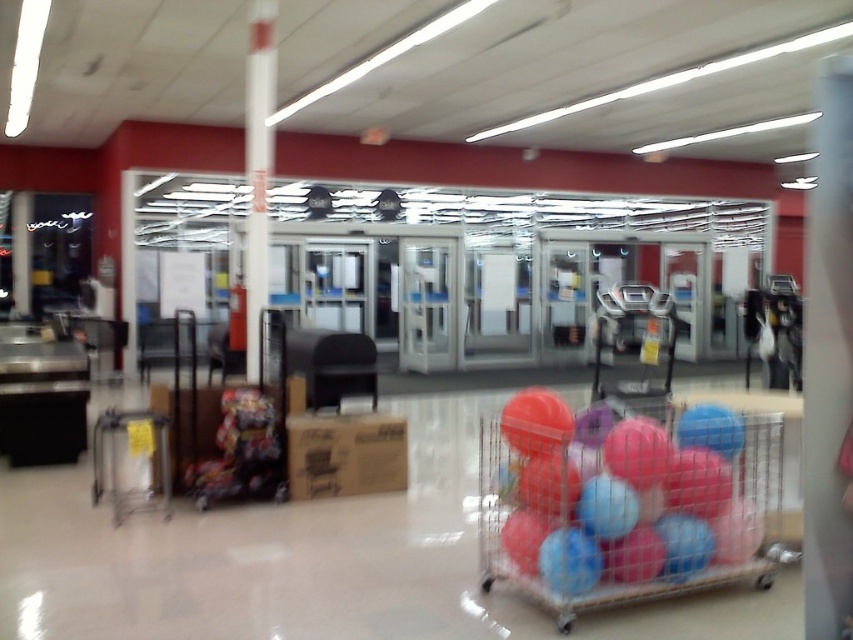
Question: Which point appears closest to the camera in this image?

Choices:
 (A) (733, 525)
 (B) (254, 168)

Answer: (A)

Question: Which of the following is the closest to the observer?

Choices:
 (A) (252, 182)
 (B) (590, 522)

Answer: (B)

Question: Is rubberized plastic ball at center smaller than white glossy pole at center?

Choices:
 (A) yes
 (B) no

Answer: (B)

Question: In this image, where is rubberized plastic ball at center located relative to white glossy pole at center?

Choices:
 (A) left
 (B) right

Answer: (B)

Question: Does rubberized plastic ball at center appear on the left side of white glossy pole at center?

Choices:
 (A) no
 (B) yes

Answer: (A)